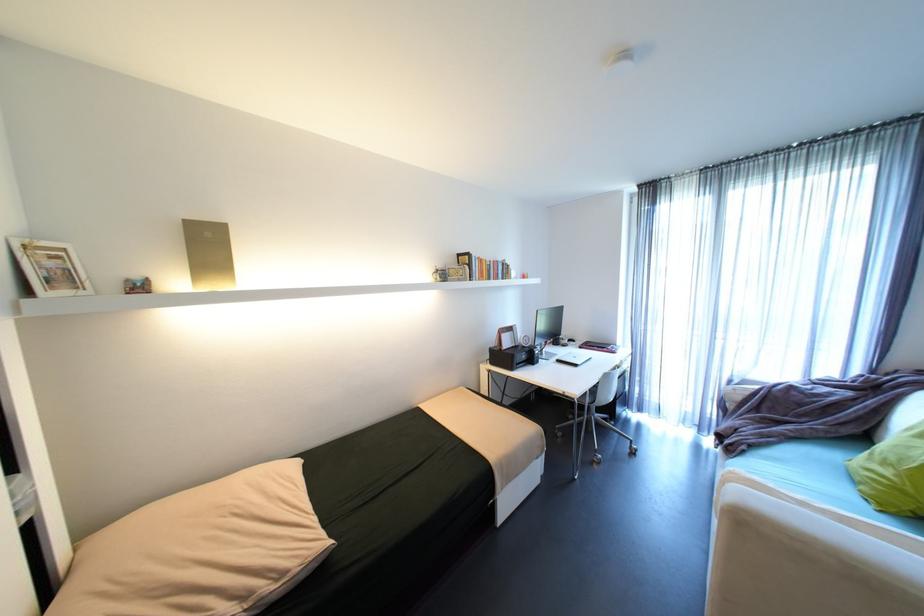
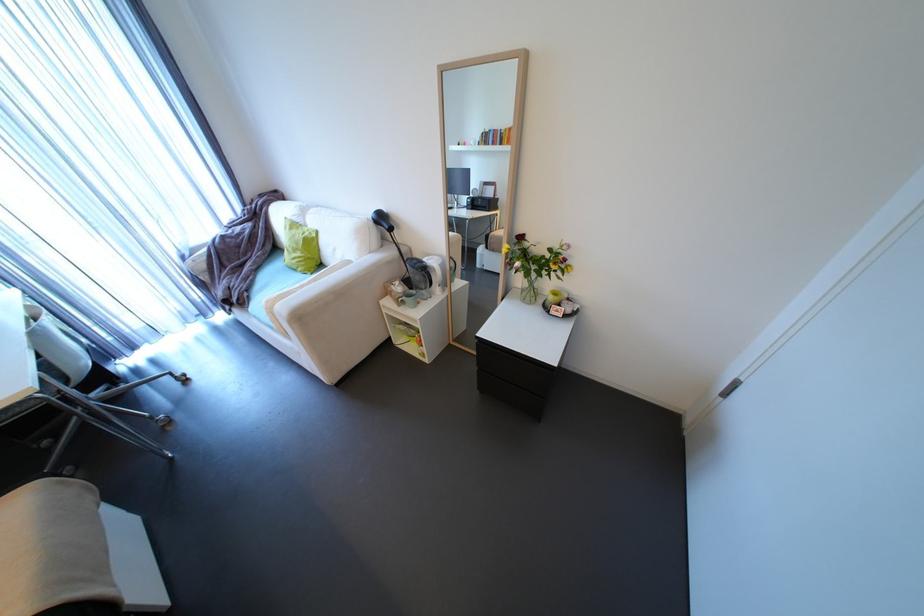
The point at (736, 448) is marked in the first image. Where is the corresponding point in the second image?

(248, 302)